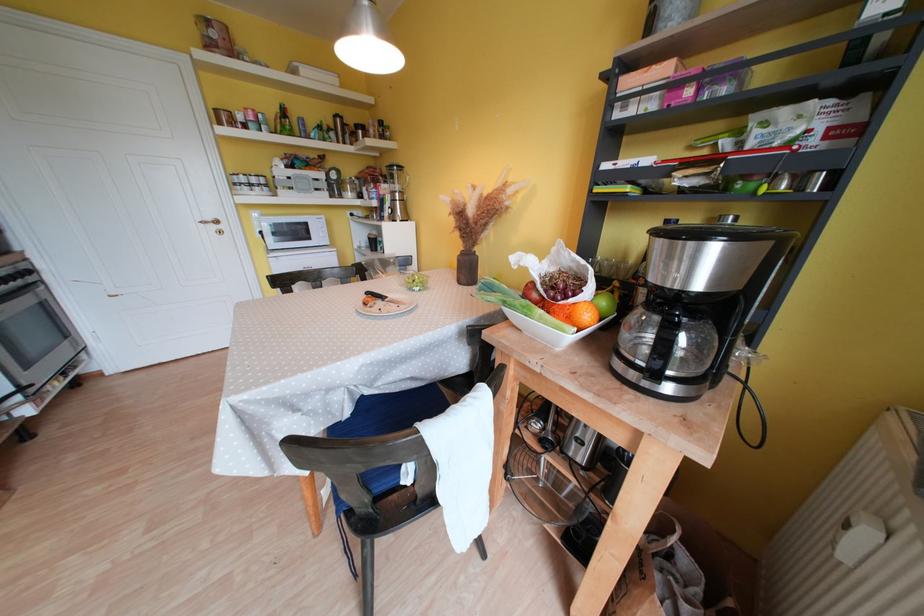
Find where to lift the green apple. Please return your answer as a coordinate pair (x, y).

(604, 304)